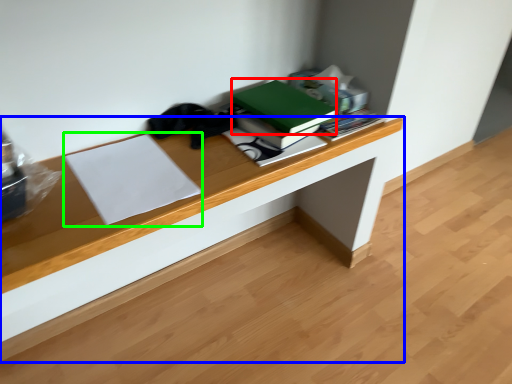
Question: Based on their relative distances, which object is nearer to paperback book (highlighted by a red box)? Choose from desk (highlighted by a blue box) and paperback book (highlighted by a green box).

Choices:
 (A) desk
 (B) paperback book

Answer: (A)